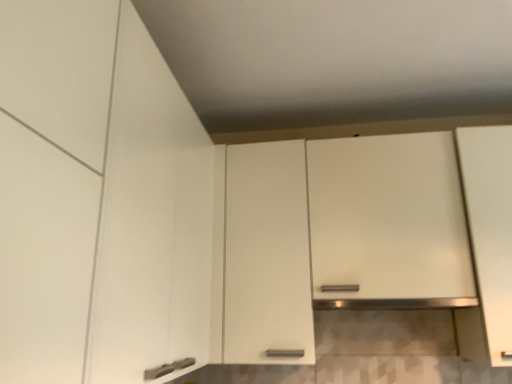
Question: Is white matte cabinet at left, the second cabinetry from the right, shorter than white matte cabinet at center, the 2th cabinetry when ordered from left to right?

Choices:
 (A) no
 (B) yes

Answer: (B)

Question: Is white matte cabinet at left, placed as the 1th cabinetry when sorted from left to right, facing towards white matte cabinet at center, the 2th cabinetry when ordered from left to right?

Choices:
 (A) no
 (B) yes

Answer: (A)

Question: Considering the relative sizes of white matte cabinet at left, the second cabinetry from the right, and white matte cabinet at center, acting as the first cabinetry starting from the right, in the image provided, is white matte cabinet at left, the second cabinetry from the right, smaller than white matte cabinet at center, acting as the first cabinetry starting from the right,?

Choices:
 (A) no
 (B) yes

Answer: (B)

Question: Considering the relative positions of white matte cabinet at left, the second cabinetry from the right, and white matte cabinet at center, the 2th cabinetry when ordered from left to right, in the image provided, is white matte cabinet at left, the second cabinetry from the right, in front of white matte cabinet at center, the 2th cabinetry when ordered from left to right,?

Choices:
 (A) no
 (B) yes

Answer: (B)

Question: Is white matte cabinet at left, placed as the 1th cabinetry when sorted from left to right, further to the viewer compared to white matte cabinet at center, the 2th cabinetry when ordered from left to right?

Choices:
 (A) yes
 (B) no

Answer: (B)

Question: Is white matte cabinet at left, placed as the 1th cabinetry when sorted from left to right, outside of white matte cabinet at center, the 2th cabinetry when ordered from left to right?

Choices:
 (A) yes
 (B) no

Answer: (A)

Question: Is white matte cabinet at center, acting as the first cabinetry starting from the right, smaller than white matte cabinet at left, placed as the 1th cabinetry when sorted from left to right?

Choices:
 (A) no
 (B) yes

Answer: (A)

Question: Can you confirm if white matte cabinet at center, the 2th cabinetry when ordered from left to right, is wider than white matte cabinet at left, placed as the 1th cabinetry when sorted from left to right?

Choices:
 (A) no
 (B) yes

Answer: (A)

Question: Does white matte cabinet at center, the 2th cabinetry when ordered from left to right, contain white matte cabinet at left, placed as the 1th cabinetry when sorted from left to right?

Choices:
 (A) no
 (B) yes

Answer: (A)

Question: Is white matte cabinet at center, acting as the first cabinetry starting from the right, thinner than white matte cabinet at left, the second cabinetry from the right?

Choices:
 (A) no
 (B) yes

Answer: (B)

Question: From a real-world perspective, is white matte cabinet at center, the 2th cabinetry when ordered from left to right, positioned under white matte cabinet at left, the second cabinetry from the right, based on gravity?

Choices:
 (A) no
 (B) yes

Answer: (A)

Question: Does white matte cabinet at center, the 2th cabinetry when ordered from left to right, appear on the left side of white matte cabinet at left, the second cabinetry from the right?

Choices:
 (A) no
 (B) yes

Answer: (A)

Question: Considering the positions of white matte cabinet at left, the second cabinetry from the right, and white matte cabinet at center, the 2th cabinetry when ordered from left to right, in the image, is white matte cabinet at left, the second cabinetry from the right, wider or thinner than white matte cabinet at center, the 2th cabinetry when ordered from left to right,?

Choices:
 (A) wide
 (B) thin

Answer: (A)